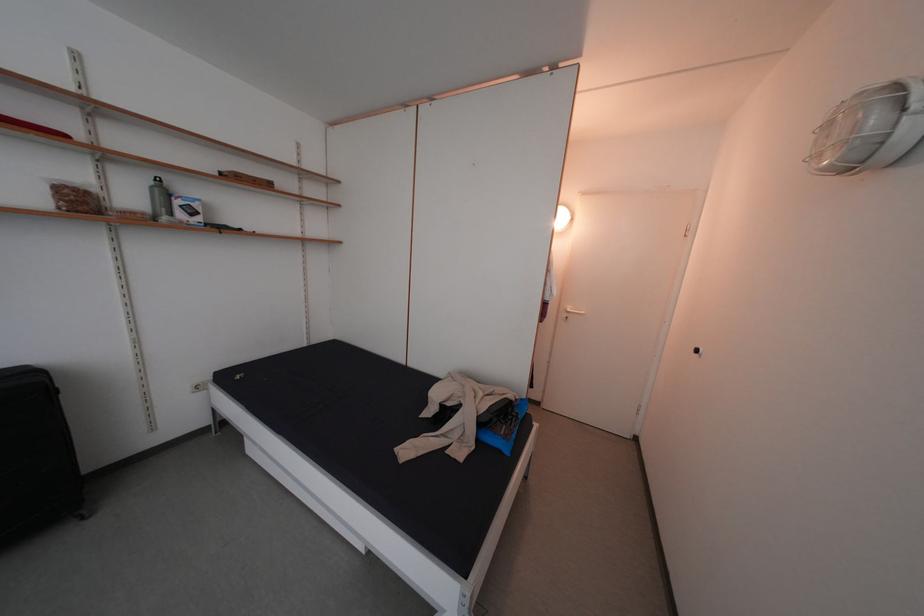
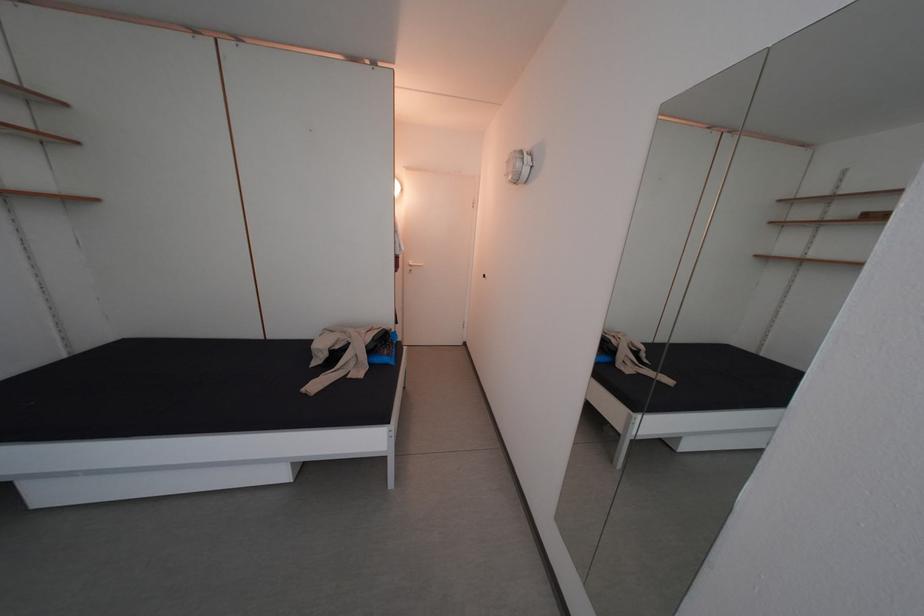
The point at (886, 124) is marked in the first image. Where is the corresponding point in the second image?

(528, 169)